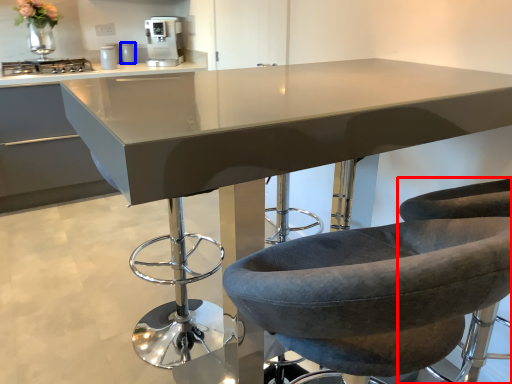
Question: Which point is further to the camera, chair (highlighted by a red box) or appliance (highlighted by a blue box)?

Choices:
 (A) chair
 (B) appliance

Answer: (B)